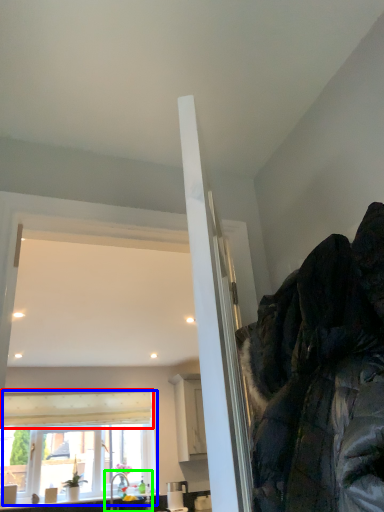
Question: Which object is positioned farthest from curtain (highlighted by a red box)? Select from window (highlighted by a blue box) and sink (highlighted by a green box).

Choices:
 (A) window
 (B) sink

Answer: (B)